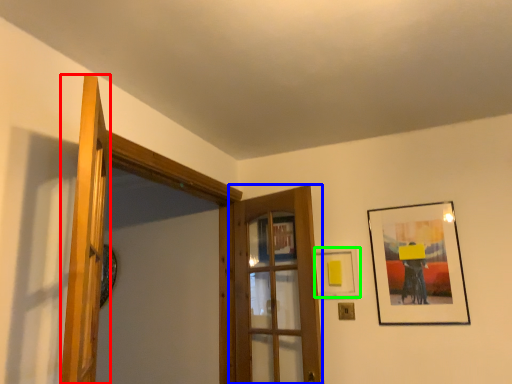
Question: Which is farther away from door (highlighted by a red box)? door (highlighted by a blue box) or picture frame (highlighted by a green box)?

Choices:
 (A) door
 (B) picture frame

Answer: (B)